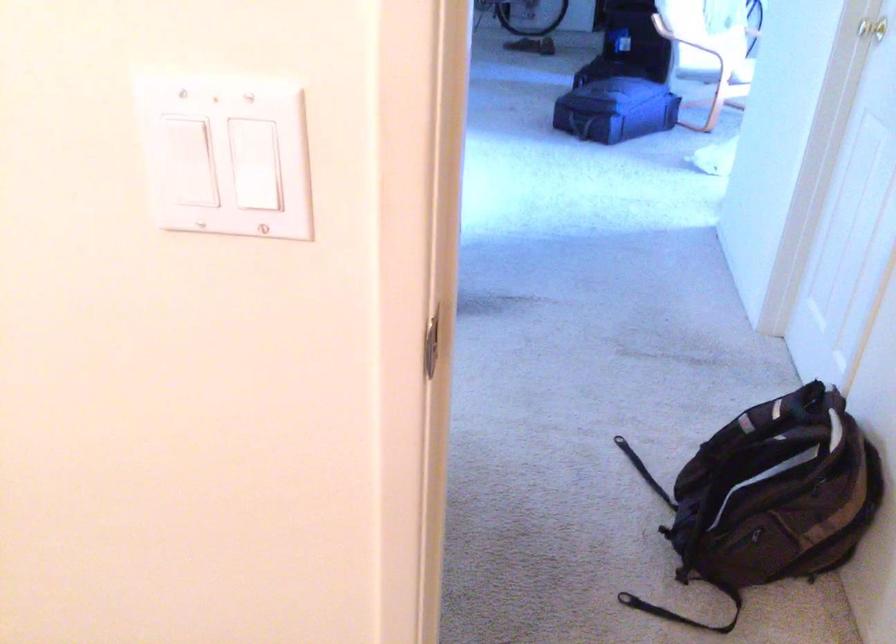
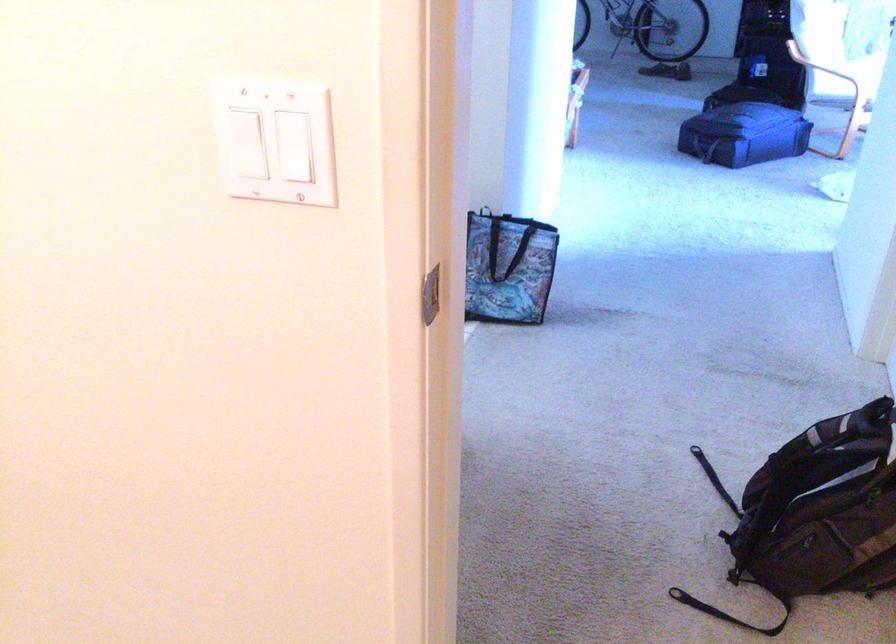
In the second image, find the point that corresponds to point (643, 475) in the first image.

(713, 478)